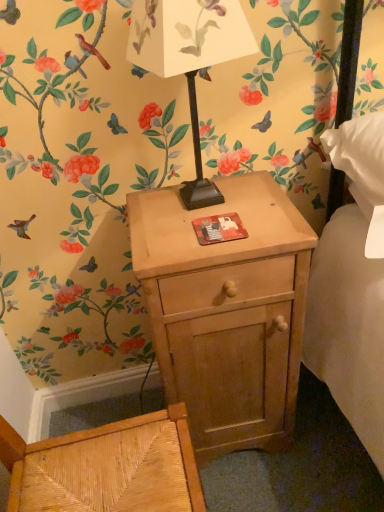
Question: Considering the positions of light wood nightstand at center and matte black table lamp at center in the image, is light wood nightstand at center bigger or smaller than matte black table lamp at center?

Choices:
 (A) big
 (B) small

Answer: (A)

Question: From their relative heights in the image, would you say light wood nightstand at center is taller or shorter than matte black table lamp at center?

Choices:
 (A) short
 (B) tall

Answer: (B)

Question: Is point (215, 358) positioned closer to the camera than point (198, 67)?

Choices:
 (A) farther
 (B) closer

Answer: (A)

Question: Is point (205, 59) positioned closer to the camera than point (200, 322)?

Choices:
 (A) closer
 (B) farther

Answer: (A)

Question: From their relative heights in the image, would you say matte black table lamp at center is taller or shorter than light wood nightstand at center?

Choices:
 (A) short
 (B) tall

Answer: (A)

Question: From a real-world perspective, is matte black table lamp at center physically located above or below light wood nightstand at center?

Choices:
 (A) below
 (B) above

Answer: (B)

Question: In terms of width, does matte black table lamp at center look wider or thinner when compared to light wood nightstand at center?

Choices:
 (A) wide
 (B) thin

Answer: (B)